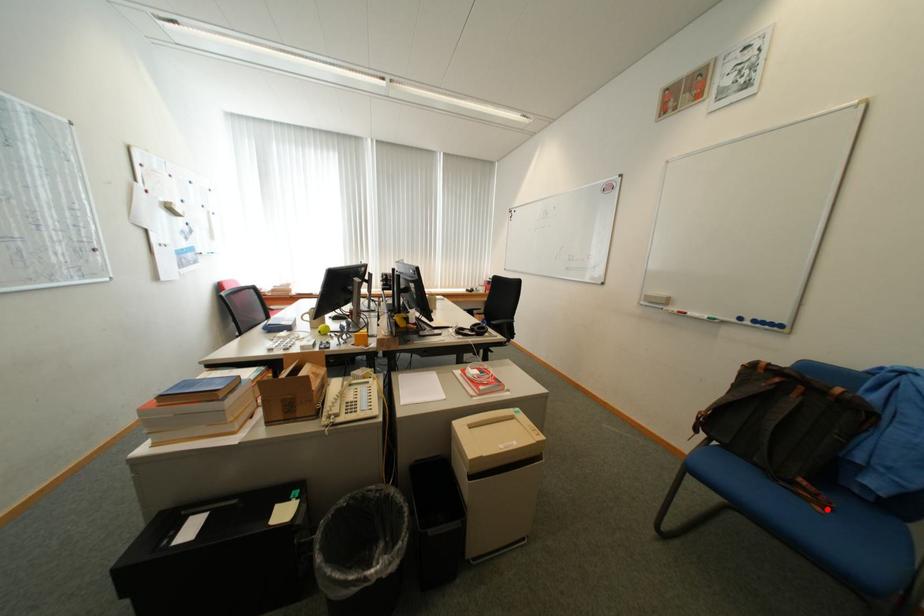
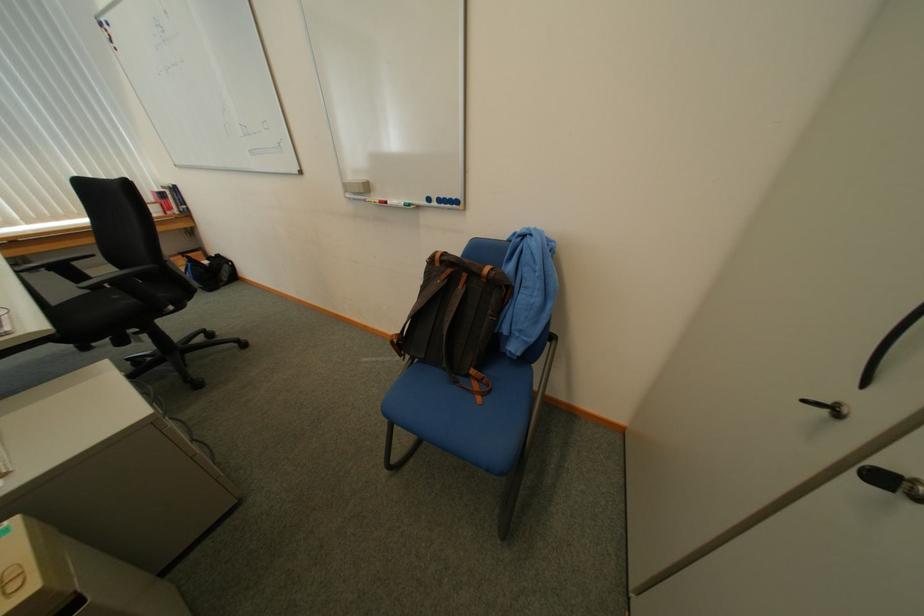
Find the pixel in the second image that matches the highlighted location in the first image.

(489, 400)